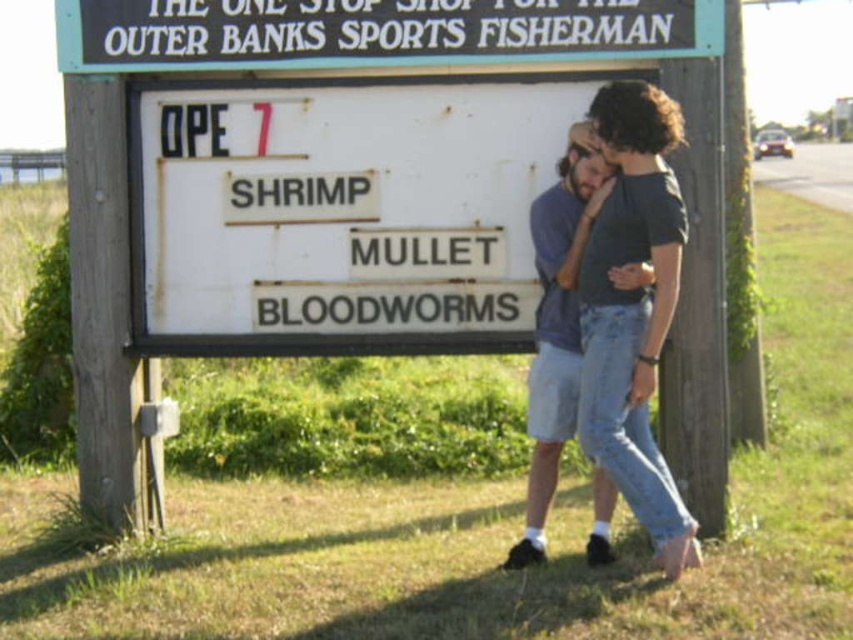
You are a customer at the shop and want to read the signboard while standing next to the denim shorts at center. Which direction should you move to face the white matte signboard at center?

The white matte signboard at center is to the left of the denim shorts at center, so you should move to the left to face the white matte signboard at center.

In the scene shown: You are a customer trying to read the signboard in the image. The white matte signboard at center has text about bait options. However, you notice that the denim shorts at center is partially blocking your view. Can you still read the entire signboard text?

The white matte signboard at center is larger in size than denim shorts at center, so it is possible that the denim shorts at center only partially blocks the signboard. However, since the signboard is larger, most of its text should still be visible despite the obstruction.

You are a customer looking to buy bait for your fishing trip. You see the black plastic sign at upper center and denim shorts at center. Which object is smaller in size?

The black plastic sign at upper center is smaller than the denim shorts at center.